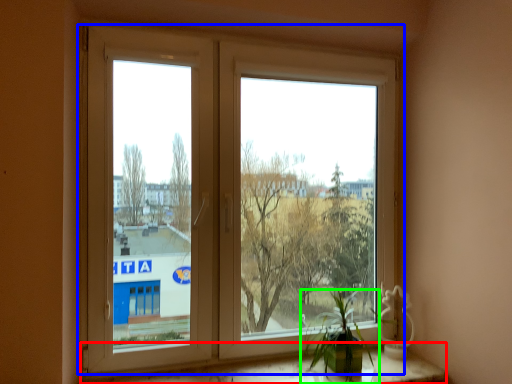
Question: Considering the real-world distances, which object is closest to window sill (highlighted by a red box)? window (highlighted by a blue box) or houseplant (highlighted by a green box).

Choices:
 (A) window
 (B) houseplant

Answer: (B)